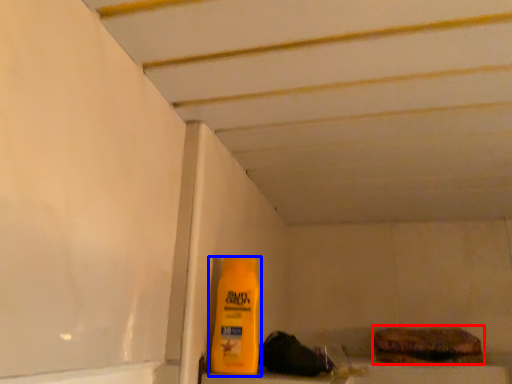
Question: Which point is further to the camera, food (highlighted by a red box) or bottle (highlighted by a blue box)?

Choices:
 (A) food
 (B) bottle

Answer: (A)